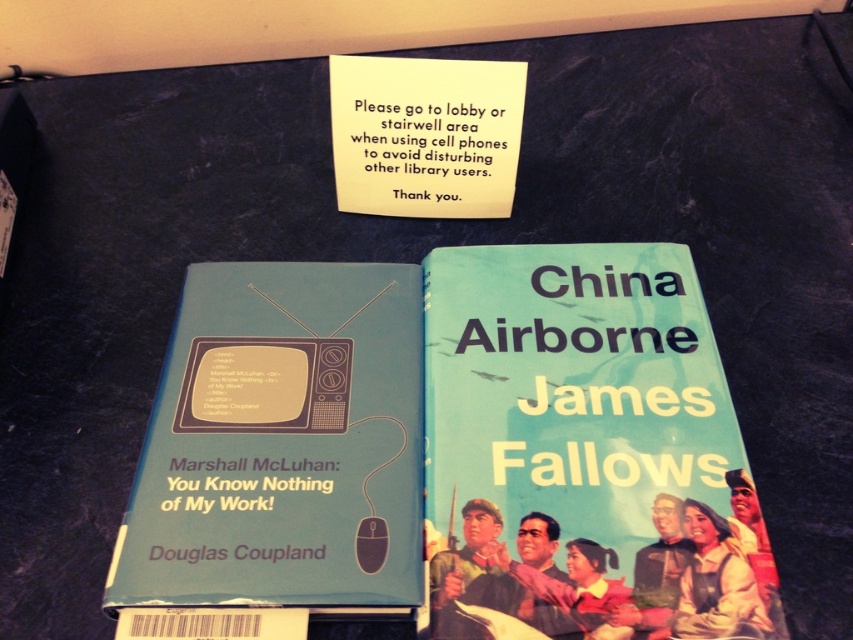
You are a book collector who wants to display the blue hardcover book at center on a shelf that is 40 inches away from the wall. Can you place it there without it being too close to the wall?

The blue hardcover book at center is currently 39.09 inches away from the viewer, so placing it on the shelf 40 inches away from the wall would mean it is slightly farther away than its current position. Since the distance difference is minimal, it should be safe to place it there without being too close to the wall.

You are organizing a library shelf and need to place a new book between the blue matte book at left and the yellow paper at upper center. Can you fit the new book there without moving either existing item?

The blue matte book at left is to the left of the yellow paper at upper center, so there is space between them where the new book can be placed.

You are organizing books on a shelf and see a point marked at coordinates (584, 452). Which book is located at this point?

The point at coordinates (584, 452) corresponds to the blue hardcover book at center.